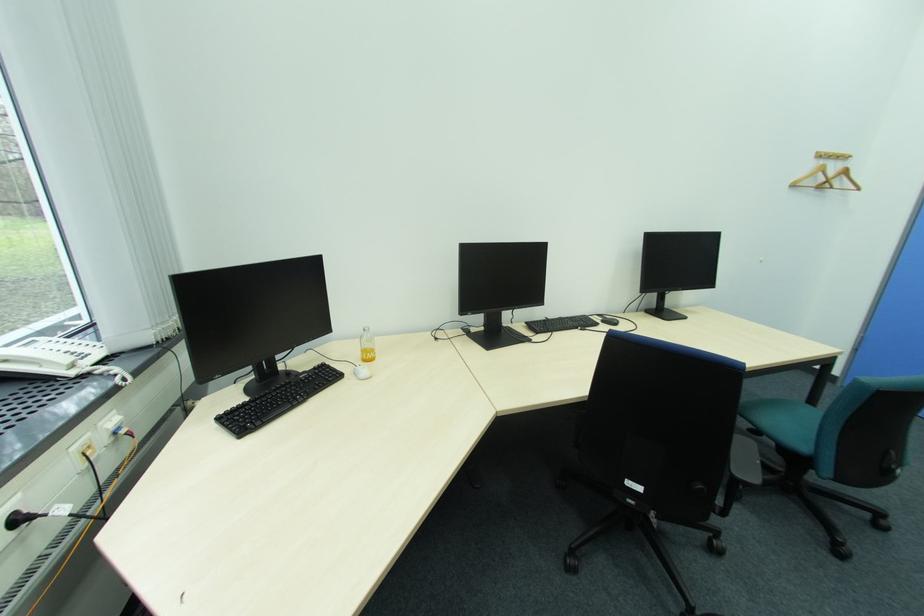
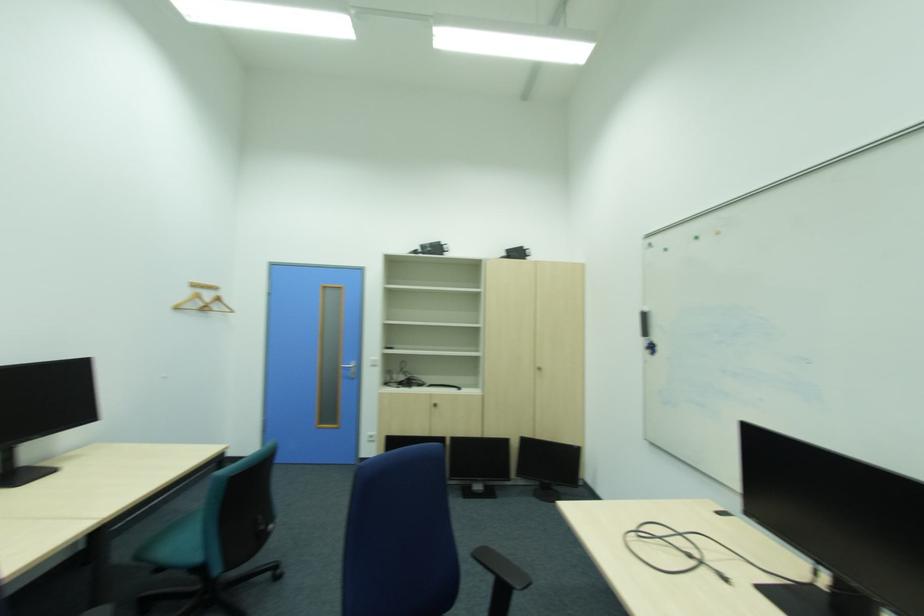
Where in the second image is the point corresponding to the point at 667,300 from the first image?

(13, 459)